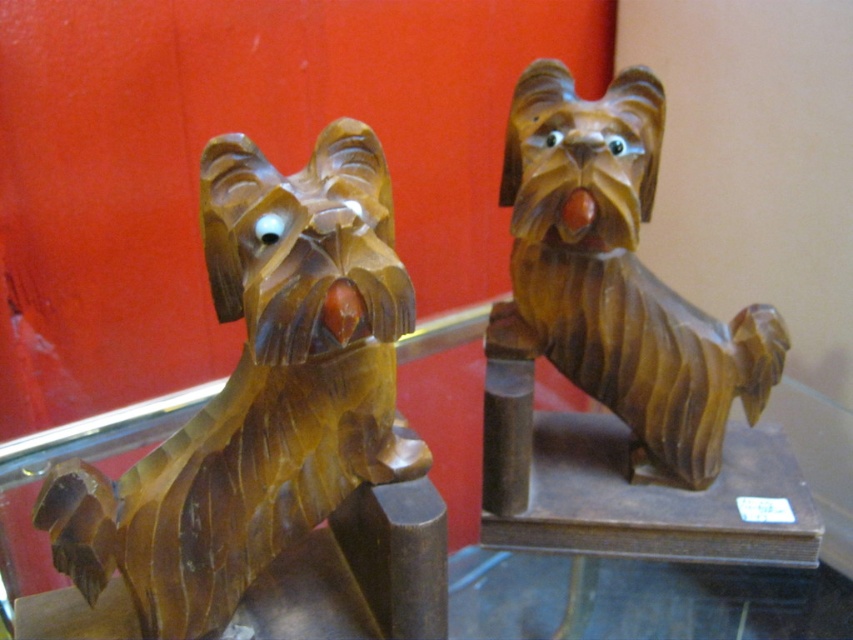
Is the position of wooden dog at left less distant than that of wooden dog at right?

Yes.

Can you confirm if wooden dog at left is positioned to the left of wooden dog at right?

Yes, wooden dog at left is to the left of wooden dog at right.

Is point (160, 561) in front of point (648, 422)?

Yes, point (160, 561) is in front of point (648, 422).

The height and width of the screenshot is (640, 853). In order to click on wooden dog at left in this screenshot , I will do `click(259, 392)`.